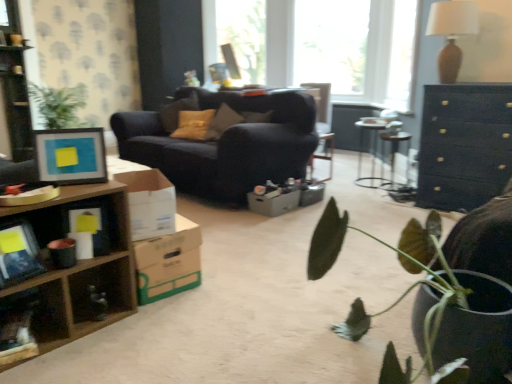
Question: Does point (68, 144) appear closer or farther from the camera than point (117, 183)?

Choices:
 (A) farther
 (B) closer

Answer: (B)

Question: Is matte black picture frame at left bigger or smaller than wooden shelf at lower left?

Choices:
 (A) big
 (B) small

Answer: (B)

Question: Which object is positioned farthest from the wooden bookshelf at left?

Choices:
 (A) cardboard box at lower left, which is counted as the second cardboard box, starting from the right
 (B) wooden shelf at lower left
 (C) matte brown pillow at center
 (D) white cardboard box at center, the first cardboard box positioned from the front
 (E) cardboard box at center, the third cardboard box from the left

Answer: (E)

Question: Which object is positioned farthest from the wooden bookshelf at left?

Choices:
 (A) matte brown pillow at center
 (B) matte black picture frame at left
 (C) cardboard box at center, the third cardboard box from the left
 (D) dark wood dresser at upper right
 (E) green matte plant at lower right

Answer: (D)